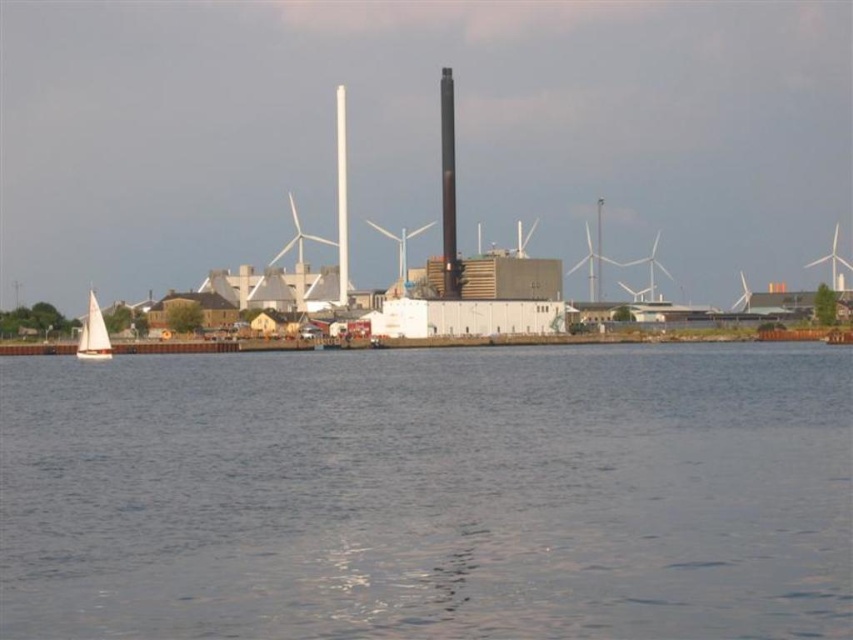
You are standing at the waterfront and want to take a photo that includes both point A at point (538, 513) and point B at point (88, 298). Which point should you focus on to ensure both are in sharp focus?

You should focus on point A at point (538, 513) because it is closer to the camera than point B at point (88, 298). By focusing on the closer point, the depth of field will likely include both points in sharp focus.

You are a drone operator trying to land a drone on the transparent water at lower center. The drone has a GPS coordinate of point (x=428, y=493). Is this point suitable for landing?

The point (x=428, y=493) is on transparent water at lower center, so yes, the drone can land there as it is on the water surface.

You are standing at the point with coordinates (93, 333) in the waterfront scene. What object are you on?

The point at coordinates (93, 333) is located on the white sailboat at left.